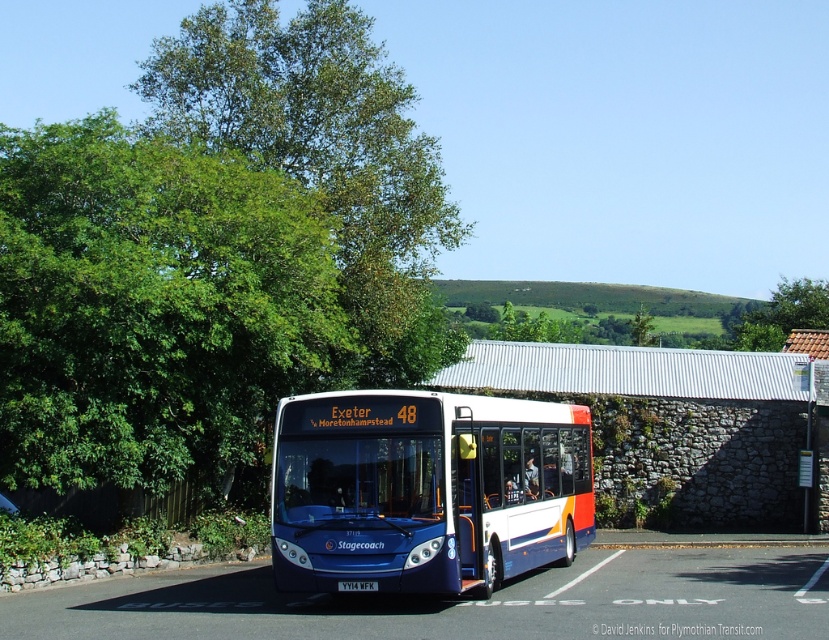
Does green leafy tree at left appear on the left side of blue metallic bus at center?

Yes, green leafy tree at left is to the left of blue metallic bus at center.

Does green leafy tree at left have a smaller size compared to blue metallic bus at center?

No.

Between point (226, 200) and point (309, 483), which one is positioned in front?

Positioned in front is point (309, 483).

Identify the location of green leafy tree at left. Image resolution: width=829 pixels, height=640 pixels. tap(149, 308).

Is green leafy tree at upper left wider than blue metallic bus at center?

Indeed, green leafy tree at upper left has a greater width compared to blue metallic bus at center.

Who is lower down, green leafy tree at upper left or blue metallic bus at center?

Positioned lower is blue metallic bus at center.

Which is in front, point (322, 45) or point (471, 477)?

Point (471, 477)

Image resolution: width=829 pixels, height=640 pixels. In order to click on green leafy tree at upper left in this screenshot , I will do `click(325, 160)`.

From the picture: Who is shorter, green leafy tree at left or green leafy tree at upper left?

With less height is green leafy tree at left.

Which is more to the right, green leafy tree at left or green leafy tree at upper left?

green leafy tree at upper left is more to the right.

Between point (66, 188) and point (393, 353), which one is positioned in front?

Positioned in front is point (66, 188).

Where is `green leafy tree at left`? This screenshot has width=829, height=640. green leafy tree at left is located at coordinates (149, 308).